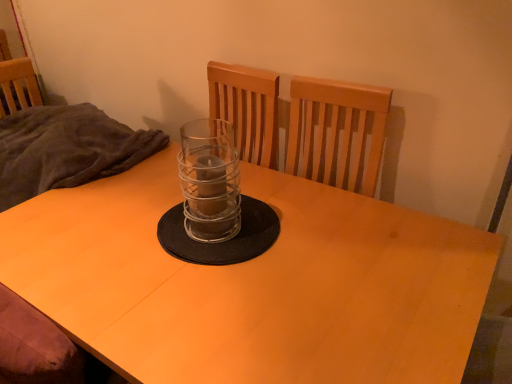
Locate an element on the screen. This screenshot has height=384, width=512. free point above matte wood desk at center (from a real-world perspective) is located at coordinates (222, 258).